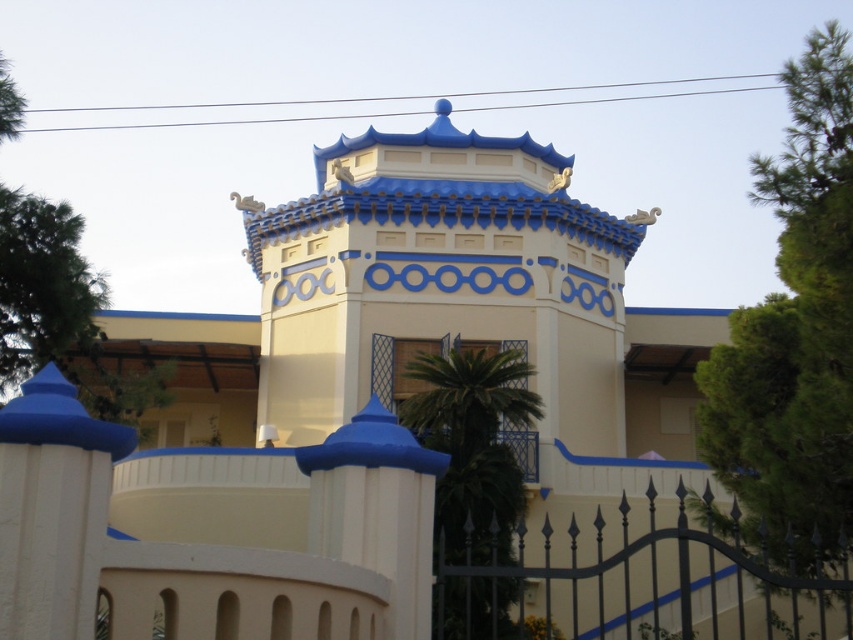
You are standing at the entrance of the building and want to walk towards the green leafy palm tree at center. Is the black wrought iron fence at lower right blocking your path?

The black wrought iron fence at lower right is larger in size than green leafy palm tree at center, but since the palm tree is at the center and the fence is at the lower right, the fence may not necessarily block the path. However, without knowing the exact positioning, it is difficult to determine for sure.

You are a visitor standing in front of the building and want to walk from the black wrought iron fence at lower right to the green leafy palm tree at center. Which direction should you move to reach the palm tree from the fence?

Since the black wrought iron fence at lower right is wider than the green leafy palm tree at center, you should move towards the center from the lower right to reach the palm tree.